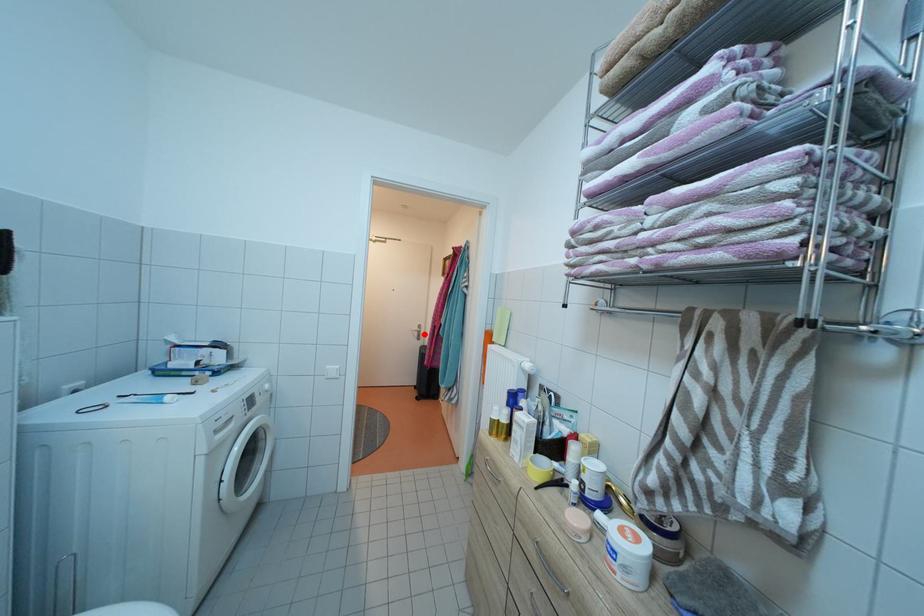
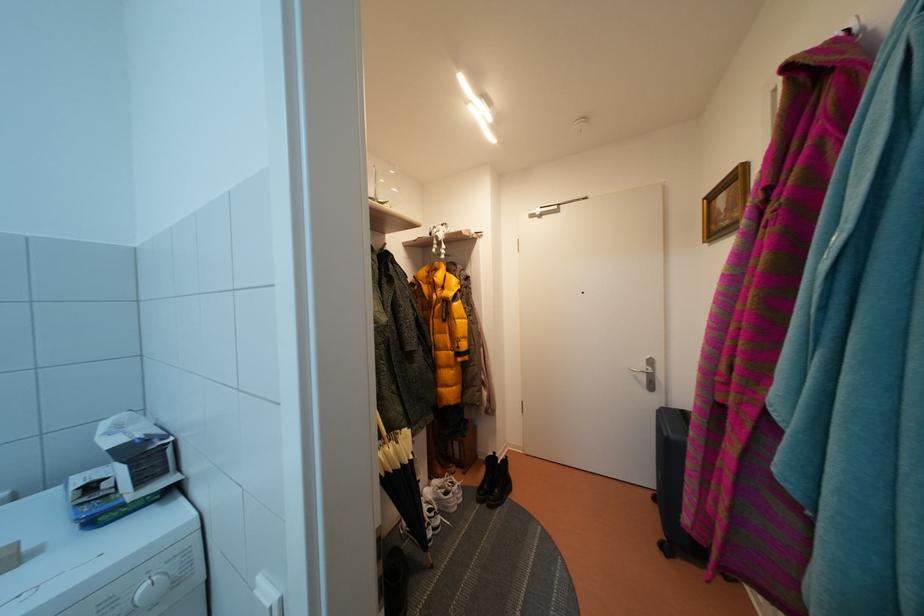
Locate, in the second image, the point that corresponds to the highlighted location in the first image.

(650, 371)